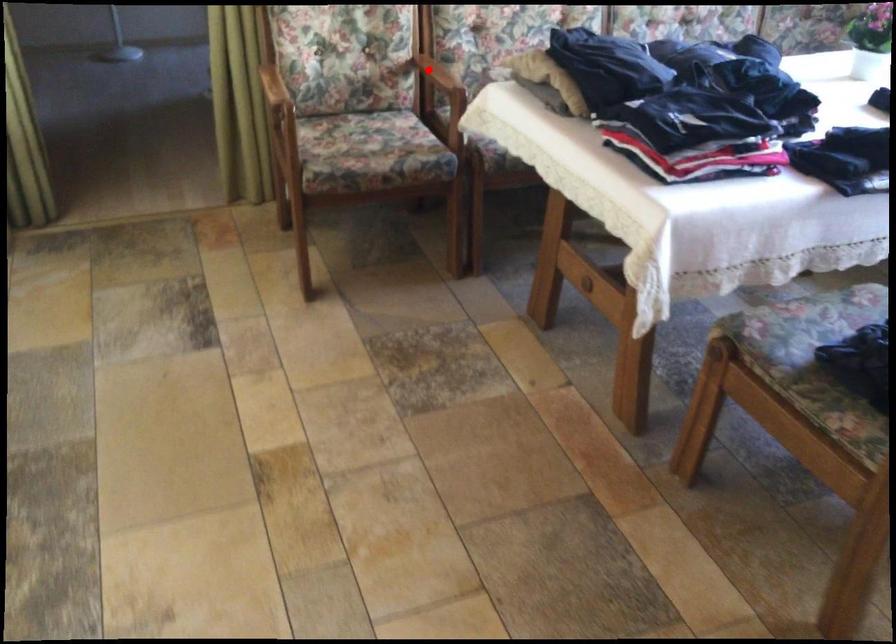
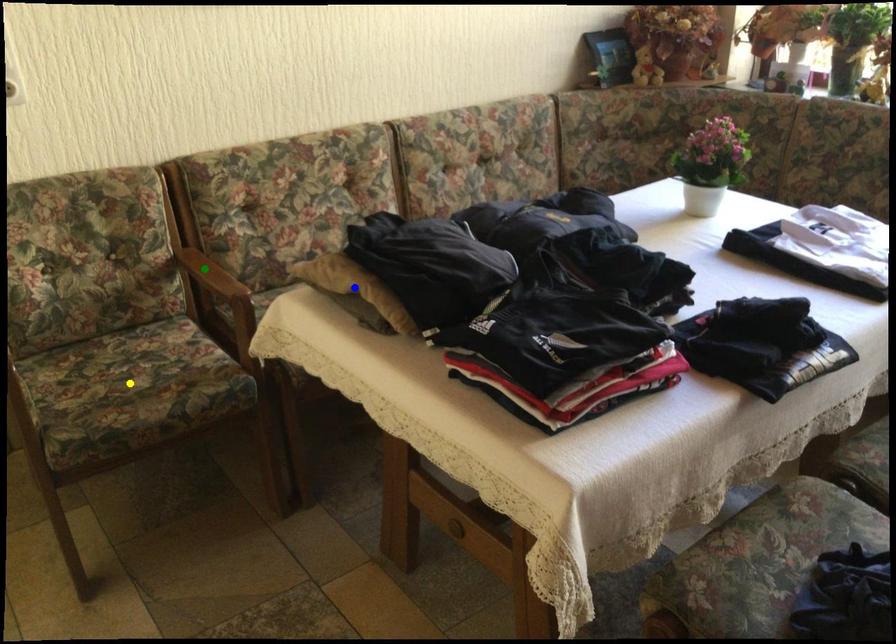
Question: I am providing you with two images of the same scene from different viewpoints. A red point is marked on the first image. You are given multiple points on the second image. Can you choose the point in image 2 that corresponds to the point in image 1?

Choices:
 (A) yellow point
 (B) blue point
 (C) green point

Answer: (C)